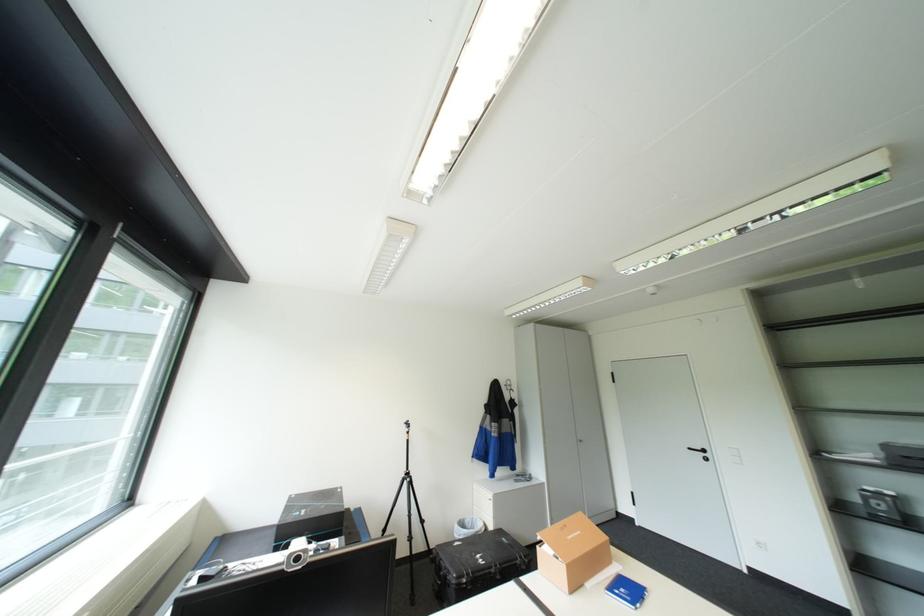
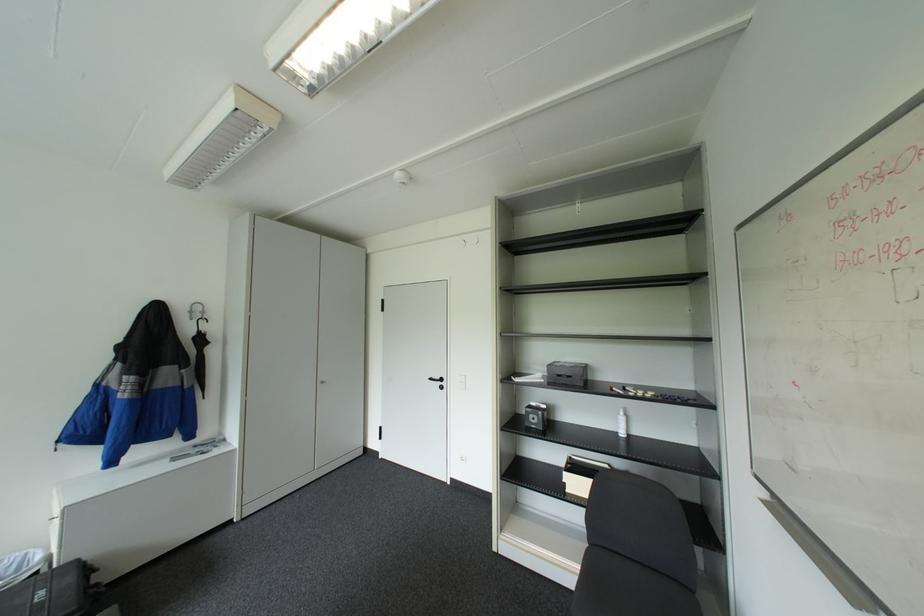
Locate, in the second image, the point that corresponds to point 516,389 in the first image.

(200, 318)